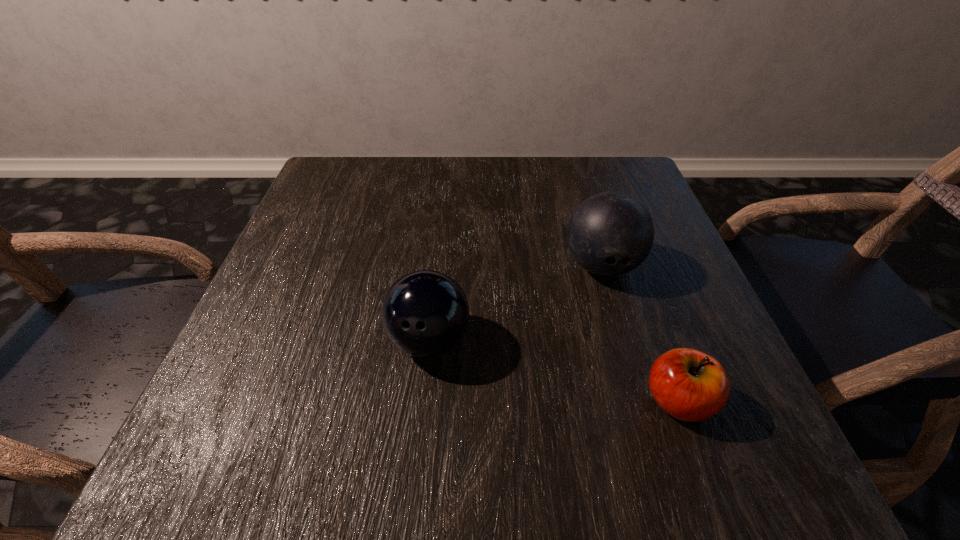
At what (x,y) coordinates should I click in order to perform the action: click on empty space that is in between the leftmost object and the apple. Please return your answer as a coordinate pair (x, y). Looking at the image, I should click on (554, 370).

Identify the location of vacant area that lies between the left bowling ball and the right bowling ball. The image size is (960, 540). (516, 303).

Locate an element on the screen. This screenshot has height=540, width=960. vacant area that lies between the shortest object and the farthest object is located at coordinates (640, 333).

At what (x,y) coordinates should I click in order to perform the action: click on vacant area between the left bowling ball and the farther bowling ball. Please return your answer as a coordinate pair (x, y). The width and height of the screenshot is (960, 540). Looking at the image, I should click on (516, 303).

Locate an element on the screen. The width and height of the screenshot is (960, 540). vacant space that is in between the apple and the farther bowling ball is located at coordinates (640, 333).

At what (x,y) coordinates should I click in order to perform the action: click on free space between the shortest object and the left bowling ball. Please return your answer as a coordinate pair (x, y). The image size is (960, 540). Looking at the image, I should click on (554, 370).

Find the location of a particular element. The width and height of the screenshot is (960, 540). vacant space that's between the apple and the leftmost object is located at coordinates (554, 370).

Where is `unoccupied position between the apple and the farther bowling ball`? This screenshot has width=960, height=540. unoccupied position between the apple and the farther bowling ball is located at coordinates (640, 333).

You are a GUI agent. You are given a task and a screenshot of the screen. Output one action in this format:
    pyautogui.click(x=<x>, y=<y>)
    Task: Click on the vacant area that lies between the right bowling ball and the left bowling ball
    
    Given the screenshot: What is the action you would take?
    pyautogui.click(x=516, y=303)

Locate which object is the second closest to the right bowling ball. Please provide its 2D coordinates. Your answer should be formatted as a tuple, i.e. [(x, y)], where the tuple contains the x and y coordinates of a point satisfying the conditions above.

[(425, 313)]